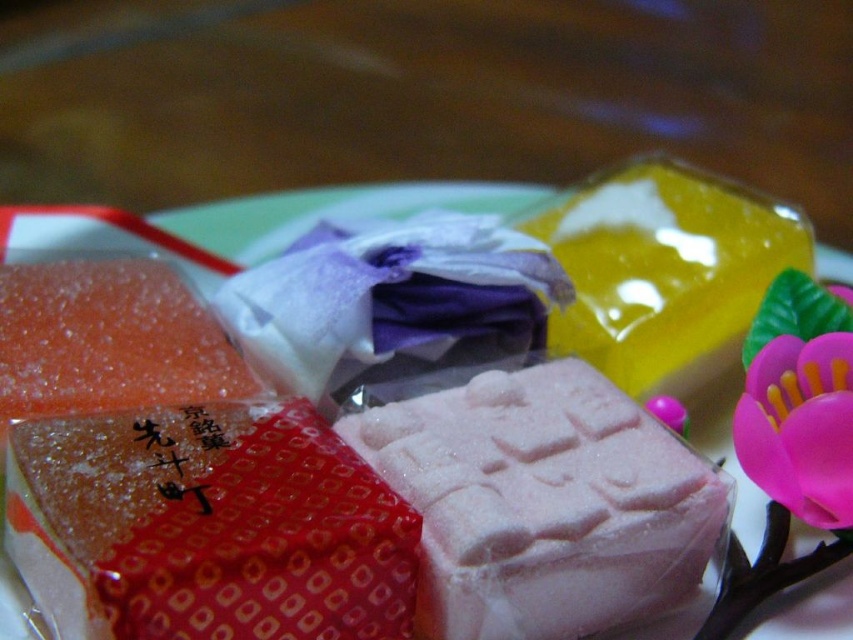
Question: Is pink sugary cube at center below white paper plate at center?

Choices:
 (A) no
 (B) yes

Answer: (B)

Question: Among these objects, which one is nearest to the camera?

Choices:
 (A) pink sugary cube at center
 (B) white paper plate at center

Answer: (A)

Question: From the image, what is the correct spatial relationship of pink sugary cube at center in relation to white paper plate at center?

Choices:
 (A) left
 (B) right

Answer: (B)

Question: Which point is closer to the camera taking this photo?

Choices:
 (A) (639, 548)
 (B) (820, 611)

Answer: (A)

Question: Is pink sugary cube at center to the right of white paper plate at center from the viewer's perspective?

Choices:
 (A) yes
 (B) no

Answer: (A)